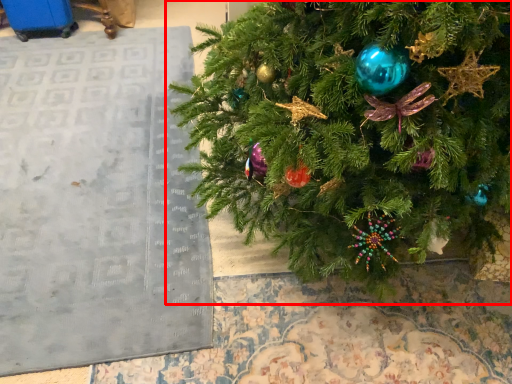
Question: From the image's perspective, where is christmas tree (annotated by the red box) located in relation to bulletin board in the image?

Choices:
 (A) above
 (B) below

Answer: (A)